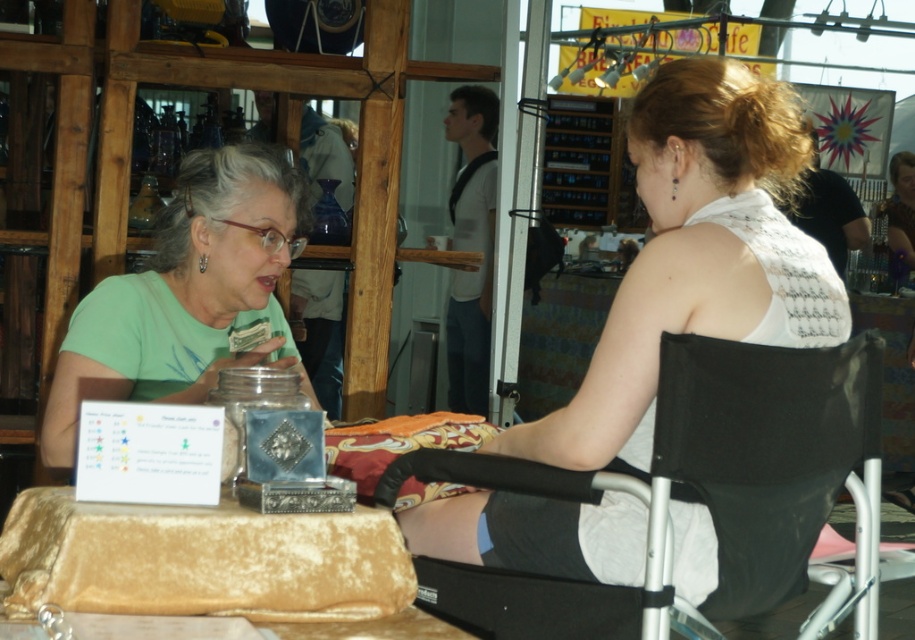
Question: Does black fabric folding chair at right have a smaller size compared to green matte shirt at left?

Choices:
 (A) yes
 (B) no

Answer: (A)

Question: Which of the following is the closest to the observer?

Choices:
 (A) (727, 538)
 (B) (576, 429)

Answer: (B)

Question: Among these objects, which one is nearest to the camera?

Choices:
 (A) black fabric folding chair at right
 (B) white lace tank top at center

Answer: (A)

Question: Can you confirm if white lace tank top at center is positioned above black fabric folding chair at right?

Choices:
 (A) yes
 (B) no

Answer: (A)

Question: Which of the following is the farthest from the observer?

Choices:
 (A) (733, 260)
 (B) (750, 433)
 (C) (219, 195)

Answer: (C)

Question: Is black fabric folding chair at right positioned in front of green matte shirt at left?

Choices:
 (A) no
 (B) yes

Answer: (B)